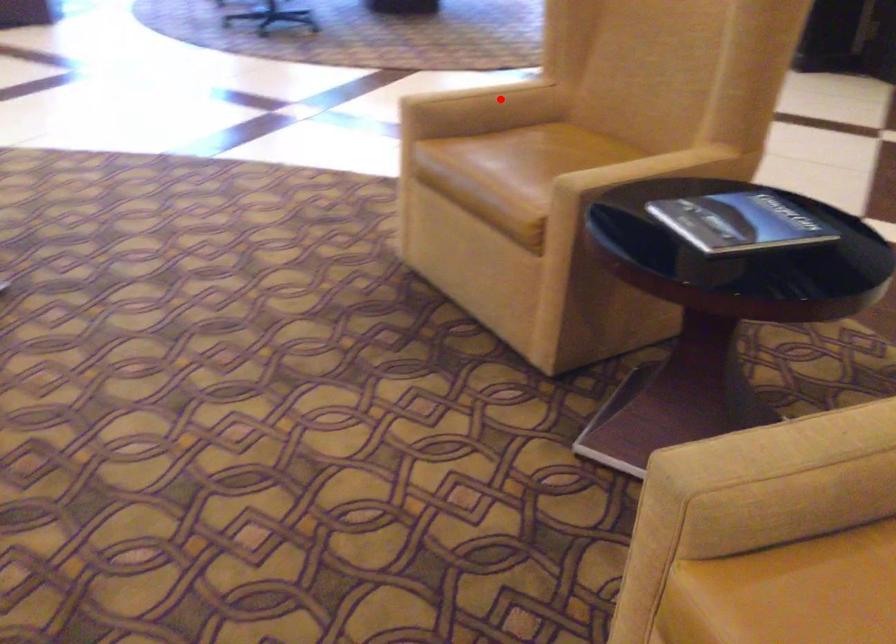
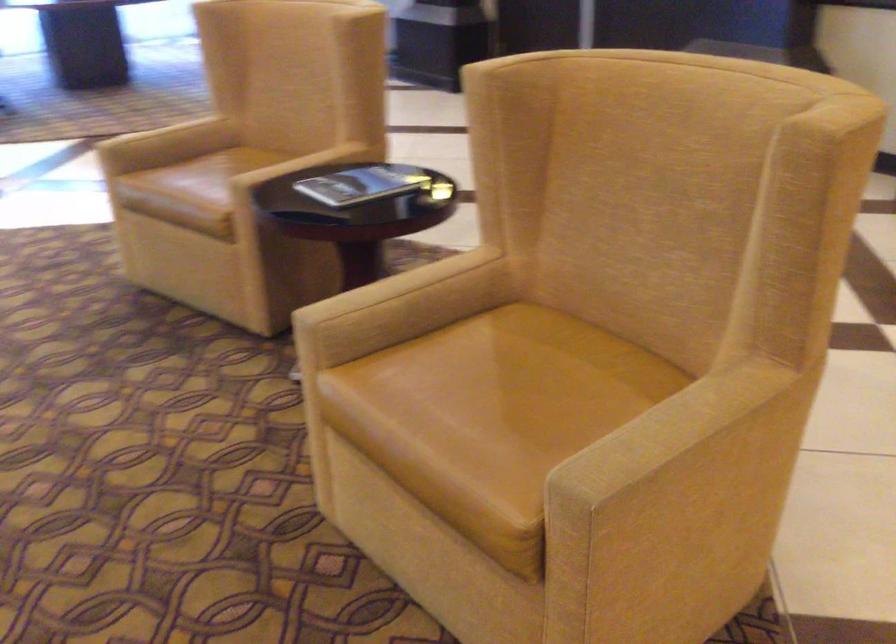
In the second image, find the point that corresponds to the highlighted location in the first image.

(183, 129)